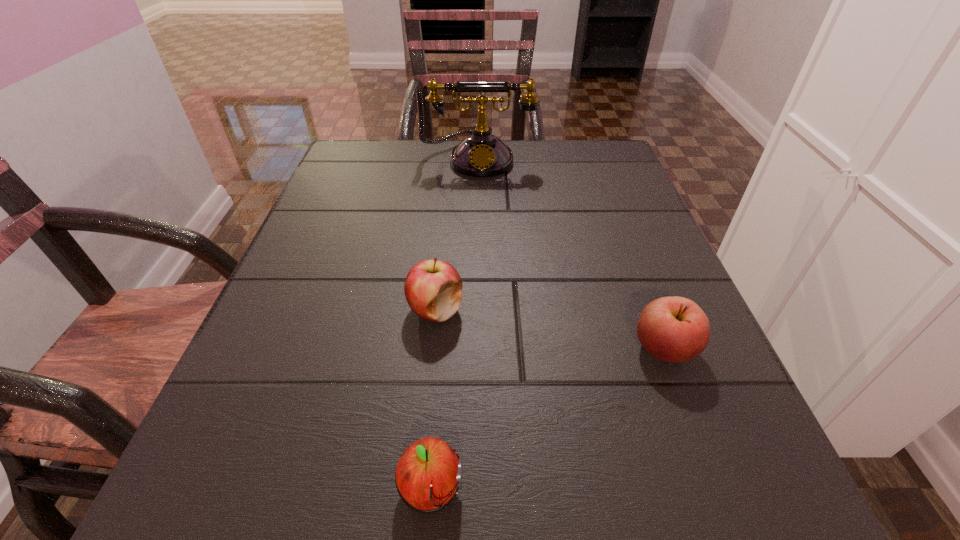
Where is `free point between the telephone and the rightmost apple`? The image size is (960, 540). free point between the telephone and the rightmost apple is located at coordinates (571, 253).

Identify which object is located as the second nearest to the nearest object. Please provide its 2D coordinates. Your answer should be formatted as a tuple, i.e. [(x, y)], where the tuple contains the x and y coordinates of a point satisfying the conditions above.

[(674, 329)]

This screenshot has width=960, height=540. Find the location of `object that is the second nearest to the farthest object`. object that is the second nearest to the farthest object is located at coordinates (674, 329).

The width and height of the screenshot is (960, 540). Identify the location of the second closest apple to the rightmost object. (428, 475).

The height and width of the screenshot is (540, 960). In order to click on the closest apple to the nearest object in this screenshot , I will do click(433, 288).

The height and width of the screenshot is (540, 960). I want to click on blank area in the image that satisfies the following two spatial constraints: 1. on the back side of the rightmost apple; 2. on the right side of the nearest object, so click(442, 348).

Locate an element on the screen. Image resolution: width=960 pixels, height=540 pixels. free point that satisfies the following two spatial constraints: 1. on the dial of the rightmost apple; 2. on the right side of the tallest object is located at coordinates (476, 348).